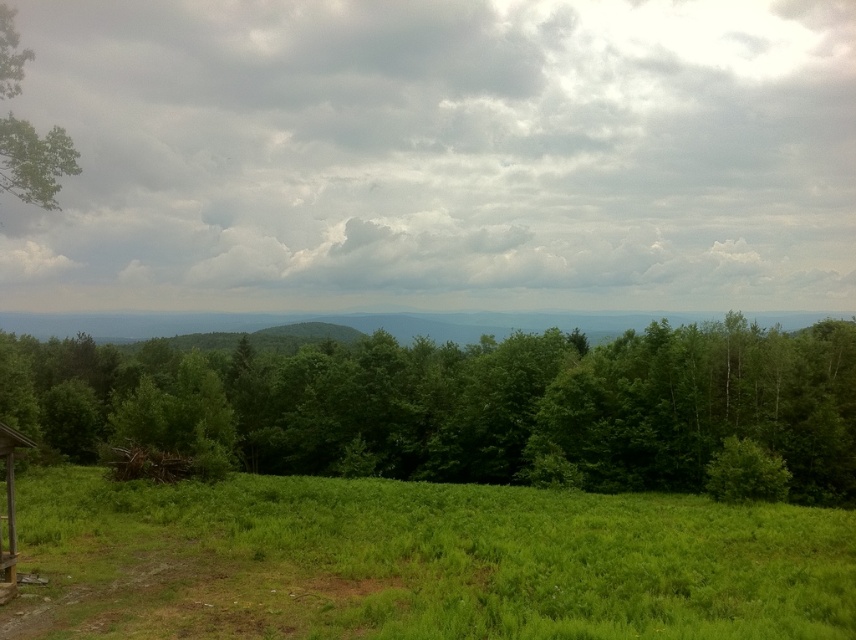
Does point (276, 566) lie behind point (15, 65)?

No, it is in front of (15, 65).

The height and width of the screenshot is (640, 856). What do you see at coordinates (423, 561) in the screenshot? I see `green grassy field at lower left` at bounding box center [423, 561].

At what (x,y) coordinates should I click in order to perform the action: click on green grassy field at lower left. Please return your answer as a coordinate pair (x, y). Image resolution: width=856 pixels, height=640 pixels. Looking at the image, I should click on (423, 561).

Which is more to the left, cloudy sky at upper center or green leafy tree at center?

Positioned to the left is green leafy tree at center.

Between point (675, 122) and point (747, 384), which one is positioned behind?

Positioned behind is point (675, 122).

Where is `cloudy sky at upper center`? The width and height of the screenshot is (856, 640). cloudy sky at upper center is located at coordinates (440, 156).

Does green grassy field at lower left have a larger size compared to green leafy tree at center?

Actually, green grassy field at lower left might be smaller than green leafy tree at center.

Between green grassy field at lower left and green leafy tree at center, which one appears on the left side from the viewer's perspective?

Positioned to the left is green leafy tree at center.

Find the location of a particular element. The height and width of the screenshot is (640, 856). green grassy field at lower left is located at coordinates (423, 561).

Locate an element on the screen. green grassy field at lower left is located at coordinates (423, 561).